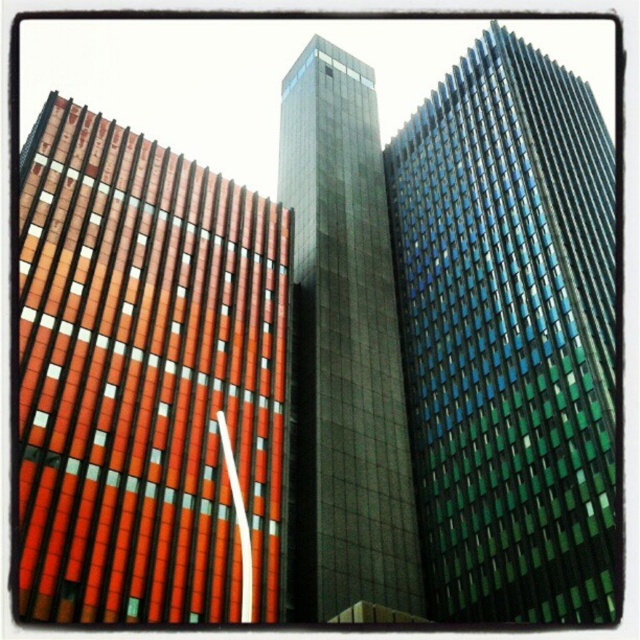
You are a drone operator who needs to fly a drone between the orange brick building at left and the dark glass tower at center. The drone has a maximum flight distance of 50 feet. Can the drone safely fly between them without exceeding its range?

The distance between the orange brick building at left and the dark glass tower at center is 52.56 feet, which exceeds the drone operator maximum flight distance of 50 feet. Therefore, the drone cannot safely fly between them without exceeding its range.

You are an architect analyzing the layout of the city skyline. You need to determine the vertical positioning of the orange brick building at left and the dark glass tower at center. Based on the scene, which one is positioned lower in the image?

The orange brick building at left is located below the dark glass tower at center, so it is positioned lower in the image.